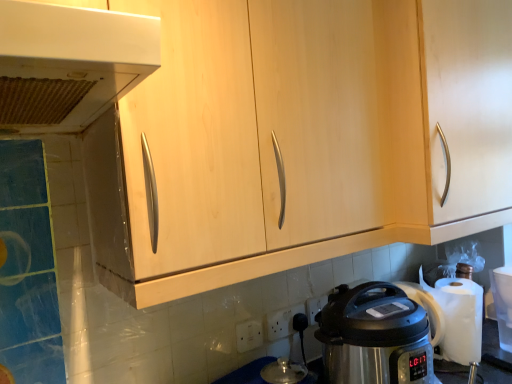
Question: Is white plastic electric outlet at lower center, placed as the 1th electric outlet when sorted from back to front, further to the viewer compared to white plastic range hood at upper left?

Choices:
 (A) no
 (B) yes

Answer: (B)

Question: Does white plastic electric outlet at lower center, positioned as the 1th electric outlet in right-to-left order, touch white plastic range hood at upper left?

Choices:
 (A) no
 (B) yes

Answer: (A)

Question: From the image's perspective, does white plastic electric outlet at lower center, which is the third electric outlet in front-to-back order, appear higher than white plastic range hood at upper left?

Choices:
 (A) yes
 (B) no

Answer: (B)

Question: Does white plastic electric outlet at lower center, placed as the 1th electric outlet when sorted from back to front, have a greater height compared to white plastic range hood at upper left?

Choices:
 (A) no
 (B) yes

Answer: (A)

Question: Would you say white plastic electric outlet at lower center, marked as the third electric outlet in a left-to-right arrangement, contains white plastic range hood at upper left?

Choices:
 (A) no
 (B) yes

Answer: (A)

Question: Is stainless steel pressure cooker at lower right to the left or to the right of light wood cabinet at center in the image?

Choices:
 (A) left
 (B) right

Answer: (B)

Question: In terms of width, does stainless steel pressure cooker at lower right look wider or thinner when compared to light wood cabinet at center?

Choices:
 (A) wide
 (B) thin

Answer: (A)

Question: In terms of height, does stainless steel pressure cooker at lower right look taller or shorter compared to light wood cabinet at center?

Choices:
 (A) short
 (B) tall

Answer: (A)

Question: From a real-world perspective, is stainless steel pressure cooker at lower right above or below light wood cabinet at center?

Choices:
 (A) above
 (B) below

Answer: (B)

Question: Is stainless steel pressure cooker at lower right wider or thinner than white plastic electric outlet at lower center, placed as the 2th electric outlet when sorted from right to left?

Choices:
 (A) wide
 (B) thin

Answer: (A)

Question: Is stainless steel pressure cooker at lower right bigger or smaller than white plastic electric outlet at lower center, placed as the 2th electric outlet when sorted from right to left?

Choices:
 (A) big
 (B) small

Answer: (A)

Question: From a real-world perspective, is stainless steel pressure cooker at lower right positioned above or below white plastic electric outlet at lower center, which is the 2th electric outlet from front to back?

Choices:
 (A) below
 (B) above

Answer: (B)

Question: Do you think stainless steel pressure cooker at lower right is within white plastic electric outlet at lower center, placed as the 2th electric outlet when sorted from right to left, or outside of it?

Choices:
 (A) inside
 (B) outside

Answer: (B)

Question: From the image's perspective, is light wood cabinet at center above or below white plastic electric outlet at lower center, placed as the 1th electric outlet when sorted from back to front?

Choices:
 (A) above
 (B) below

Answer: (A)

Question: Is light wood cabinet at center spatially inside white plastic electric outlet at lower center, positioned as the 1th electric outlet in right-to-left order, or outside of it?

Choices:
 (A) inside
 (B) outside

Answer: (B)